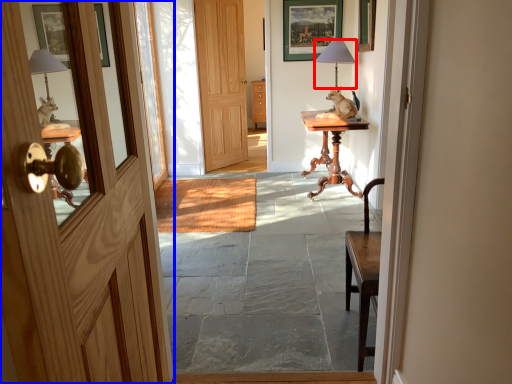
Question: Among these objects, which one is farthest to the camera, table lamp (highlighted by a red box) or door (highlighted by a blue box)?

Choices:
 (A) table lamp
 (B) door

Answer: (A)